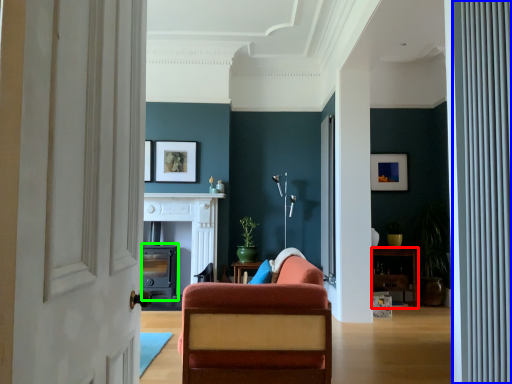
Question: Estimate the real-world distances between objects in this image. Which object is farther from furniture (highlighted by a red box), curtain (highlighted by a blue box) or fireplace (highlighted by a green box)?

Choices:
 (A) curtain
 (B) fireplace

Answer: (A)